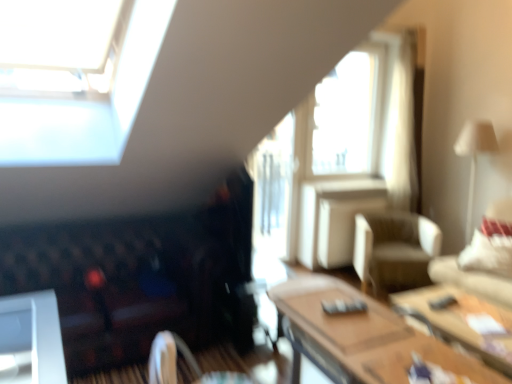
Question: From a real-world perspective, does transparent glass window at upper center stand above beige fabric swivel chair at center, positioned as the second swivel chair in front-to-back order?

Choices:
 (A) no
 (B) yes

Answer: (B)

Question: From a real-world perspective, does transparent glass window at upper center sit lower than beige fabric swivel chair at center, the 1th swivel chair in the right-to-left sequence?

Choices:
 (A) yes
 (B) no

Answer: (B)

Question: Can you confirm if transparent glass window at upper center is thinner than beige fabric swivel chair at center, which is counted as the 1th swivel chair, starting from the back?

Choices:
 (A) yes
 (B) no

Answer: (A)

Question: Is transparent glass window at upper center closer to the viewer compared to beige fabric swivel chair at center, which is counted as the 1th swivel chair, starting from the back?

Choices:
 (A) no
 (B) yes

Answer: (A)

Question: Is transparent glass window at upper center shorter than beige fabric swivel chair at center, the 1th swivel chair in the right-to-left sequence?

Choices:
 (A) yes
 (B) no

Answer: (B)

Question: Is white fabric pillow at right spatially inside velvet dark brown futon at lower left, or outside of it?

Choices:
 (A) inside
 (B) outside

Answer: (B)

Question: From a real-world perspective, is white fabric pillow at right positioned above or below velvet dark brown futon at lower left?

Choices:
 (A) above
 (B) below

Answer: (A)

Question: In terms of size, does white fabric pillow at right appear bigger or smaller than velvet dark brown futon at lower left?

Choices:
 (A) small
 (B) big

Answer: (A)

Question: Is white fabric pillow at right wider or thinner than velvet dark brown futon at lower left?

Choices:
 (A) wide
 (B) thin

Answer: (B)

Question: Relative to velvet dark brown swivel chair at lower center, the 1th swivel chair viewed from the front, is transparent glass window at upper center in front or behind?

Choices:
 (A) front
 (B) behind

Answer: (B)

Question: In the image, is transparent glass window at upper center on the left side or the right side of velvet dark brown swivel chair at lower center, which is the second swivel chair from back to front?

Choices:
 (A) right
 (B) left

Answer: (A)

Question: Considering the positions of transparent glass window at upper center and velvet dark brown swivel chair at lower center, which appears as the 2th swivel chair when viewed from the right, in the image, is transparent glass window at upper center bigger or smaller than velvet dark brown swivel chair at lower center, which appears as the 2th swivel chair when viewed from the right,?

Choices:
 (A) small
 (B) big

Answer: (B)

Question: Looking at their shapes, would you say transparent glass window at upper center is wider or thinner than velvet dark brown swivel chair at lower center, which is the second swivel chair from back to front?

Choices:
 (A) wide
 (B) thin

Answer: (B)

Question: From a real-world perspective, relative to white fabric pillow at right, is beige fabric swivel chair at center, the 2th swivel chair viewed from the left, vertically above or below?

Choices:
 (A) below
 (B) above

Answer: (A)

Question: From their relative heights in the image, would you say beige fabric swivel chair at center, the 2th swivel chair viewed from the left, is taller or shorter than white fabric pillow at right?

Choices:
 (A) tall
 (B) short

Answer: (A)